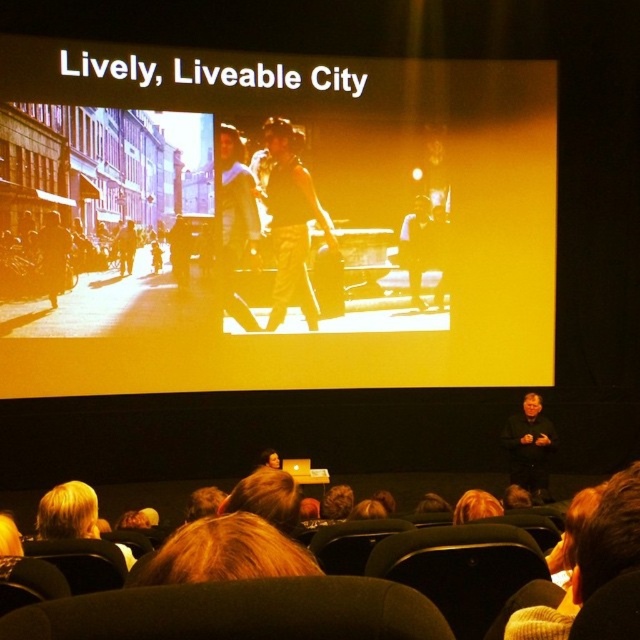
Can you confirm if matte black jacket at center is positioned below dark brown leather jacket at left?

Incorrect, matte black jacket at center is not positioned below dark brown leather jacket at left.

Can you confirm if matte black jacket at center is shorter than dark brown leather jacket at left?

No.

This screenshot has height=640, width=640. I want to click on matte black jacket at center, so click(x=416, y=244).

In the scene shown: Which is more to the right, sepia-toned photograph of people walking at center or dark brown leather jacket at left?

From the viewer's perspective, sepia-toned photograph of people walking at center appears more on the right side.

Does point (444, 304) come in front of point (45, 280)?

No, it is behind (45, 280).

Which is behind, point (513, 333) or point (48, 276)?

The point (513, 333) is behind.

At what (x,y) coordinates should I click in order to perform the action: click on sepia-toned photograph of people walking at center. Please return your answer as a coordinate pair (x, y). The width and height of the screenshot is (640, 640). Looking at the image, I should click on (307, 225).

Between matte black tank top at center and matte black dress at center, which one appears on the right side from the viewer's perspective?

matte black tank top at center is more to the right.

Who is higher up, matte black tank top at center or matte black dress at center?

Positioned higher is matte black tank top at center.

Describe the element at coordinates (291, 224) in the screenshot. I see `matte black tank top at center` at that location.

Identify the location of matte black tank top at center. (291, 224).